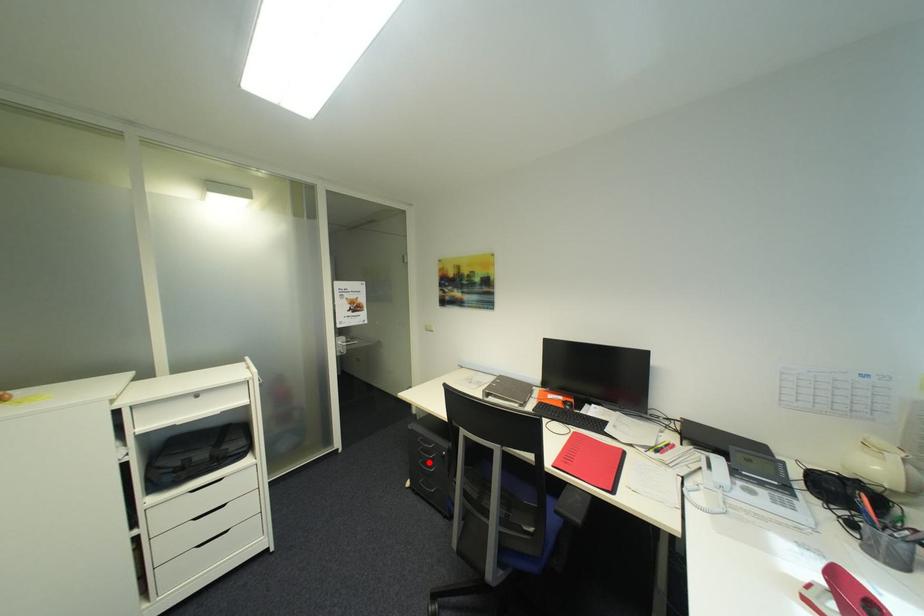
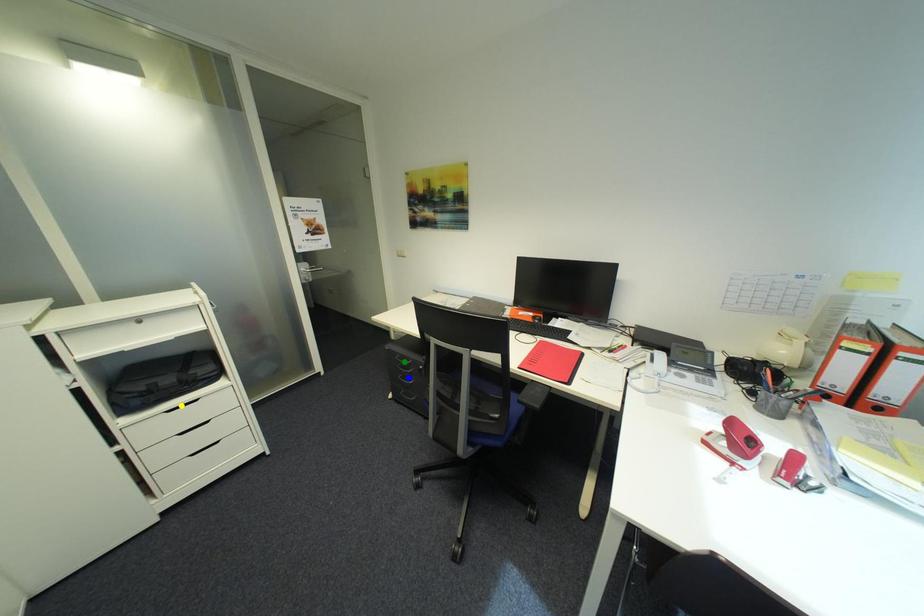
Question: I am providing you with two images of the same scene from different viewpoints. A red point is marked on the first image. You are given multiple points on the second image. Which point in image 2 is actually the same real-world point as the red point in image 1?

Choices:
 (A) yellow point
 (B) green point
 (C) blue point

Answer: (C)